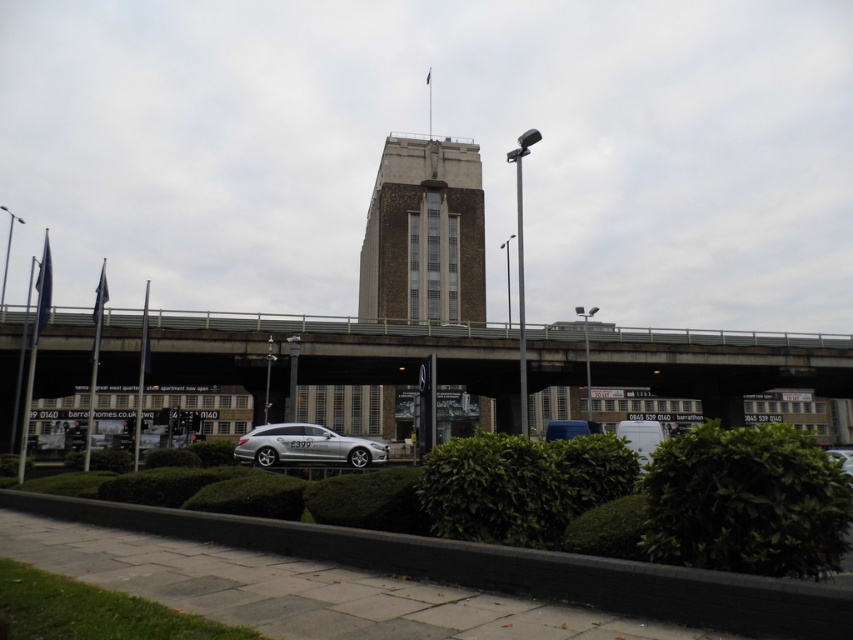
You are a delivery driver who needs to transport a large cargo container that is 1.5 times wider than your silver metallic car at lower right. You see the concrete bridge at center in the image. Can your cargo container pass through the bridge?

The concrete bridge at center is wider than the silver metallic car at lower right. Since the cargo container is 1.5 times wider than the car, the bridge should be wide enough to accommodate the container as long as the bridge width is greater than 1.5 times the car width. However, the exact dimensions are not provided, so this is an approximate assessment.

You are standing at the flagpole on top of the building. You see two points marked in the image. Which point is closer to you, point (679, 589) or point (848, 449)?

Point (679, 589) is in front of point (848, 449), so it is closer to you.